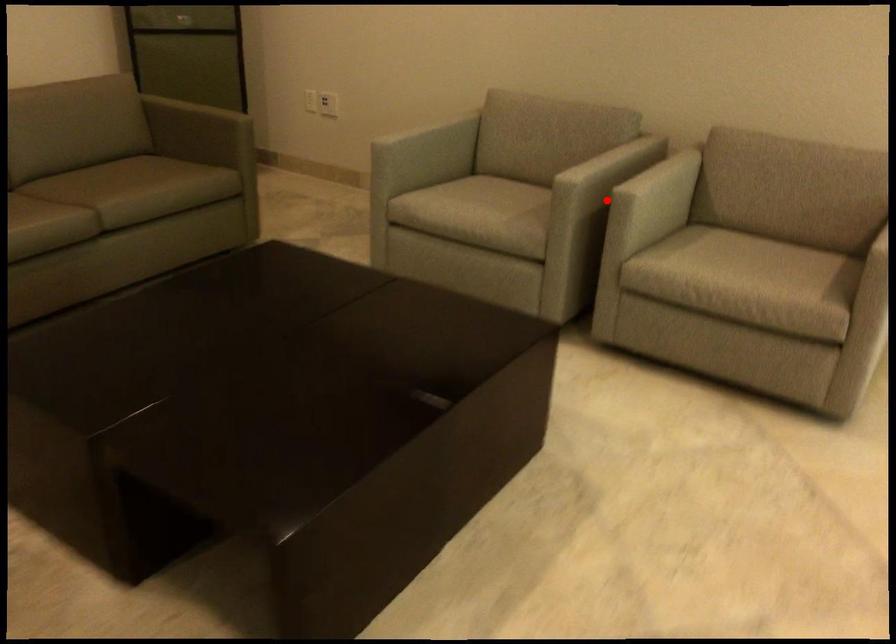
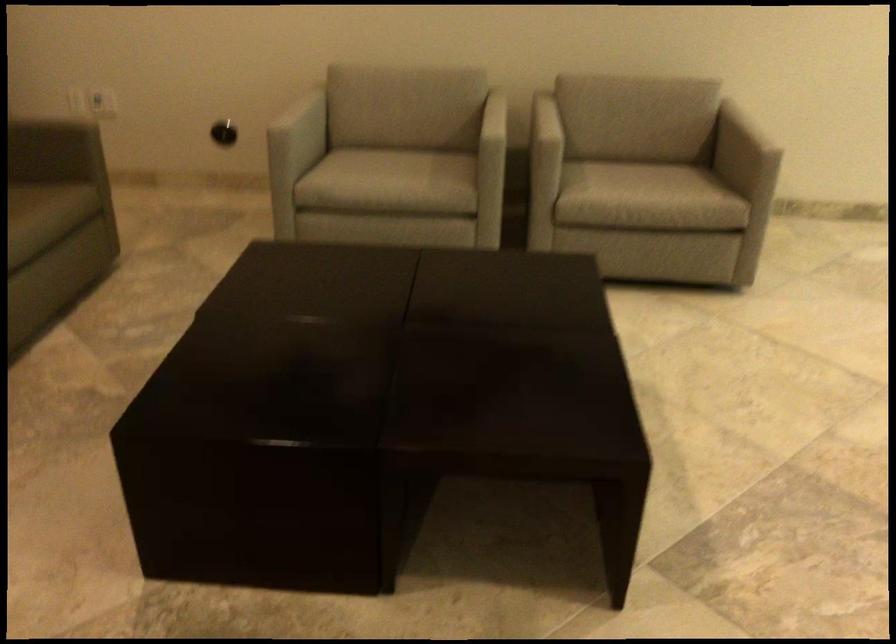
The point at the highlighted location is marked in the first image. Where is the corresponding point in the second image?

(545, 140)